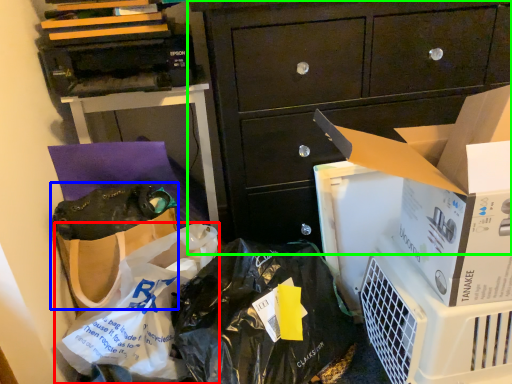
Question: Estimate the real-world distances between objects in this image. Which object is closer to plastic bag (highlighted by a red box), handbag (highlighted by a blue box) or cabinetry (highlighted by a green box)?

Choices:
 (A) handbag
 (B) cabinetry

Answer: (A)